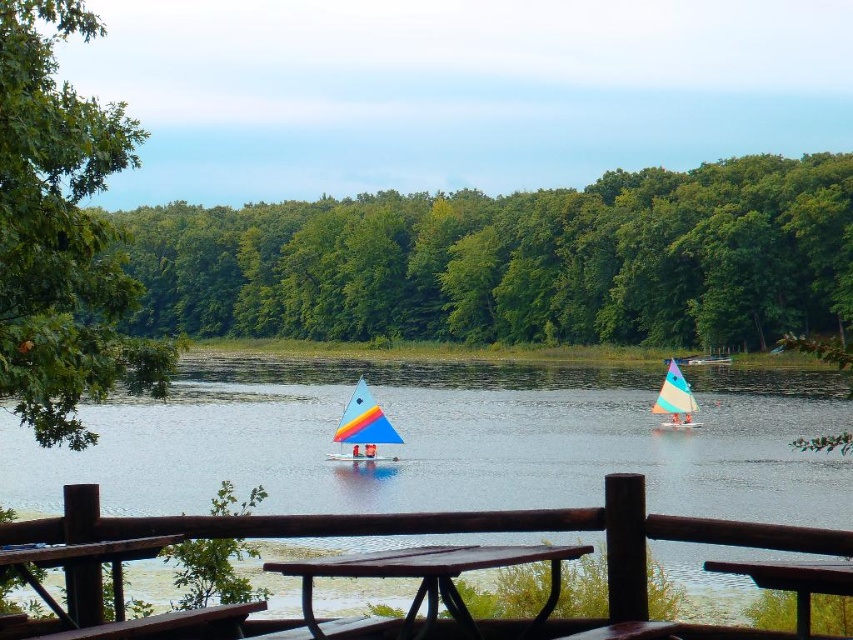
Question: Which point appears closest to the camera in this image?

Choices:
 (A) click(370, 442)
 (B) click(331, 573)
 (C) click(32, 234)

Answer: (B)

Question: Can you confirm if green leafy tree at left is positioned below rainbow sailboat at center?

Choices:
 (A) yes
 (B) no

Answer: (B)

Question: Which object is positioned farthest from the brown wood picnic table at center?

Choices:
 (A) matte blue sailboat at center
 (B) green leafy trees at upper center

Answer: (B)

Question: Does green leafy tree at left have a smaller size compared to brown wood picnic table at center?

Choices:
 (A) yes
 (B) no

Answer: (B)

Question: Where is green leafy trees at upper center located in relation to green leafy tree at left in the image?

Choices:
 (A) below
 (B) above

Answer: (A)

Question: Which object is closer to the camera taking this photo?

Choices:
 (A) green leafy tree at left
 (B) rainbow sailboat at center
 (C) green leafy trees at upper center
 (D) brown wood picnic table at center

Answer: (D)